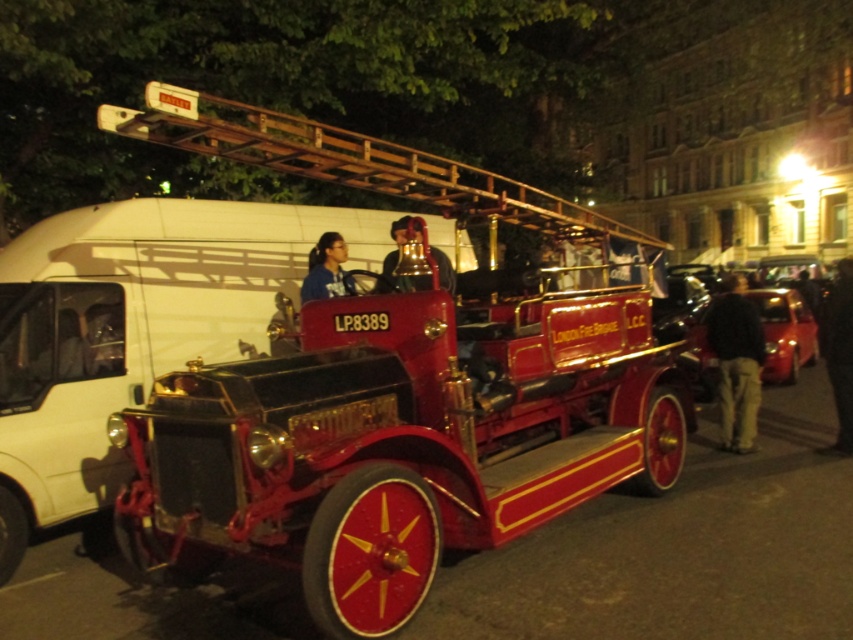
You are standing in front of the vintage fire engine and want to touch both points labeled as point (x=175, y=241) and point (x=831, y=310). Which point should you reach for first to touch the one closer to you?

You should reach for point (x=175, y=241) first because it is closer to you than point (x=831, y=310).